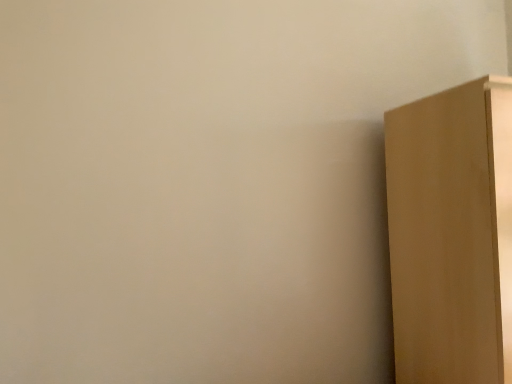
Question: Should I look upward or downward to see matte cardboard box at right?

Choices:
 (A) up
 (B) down

Answer: (B)